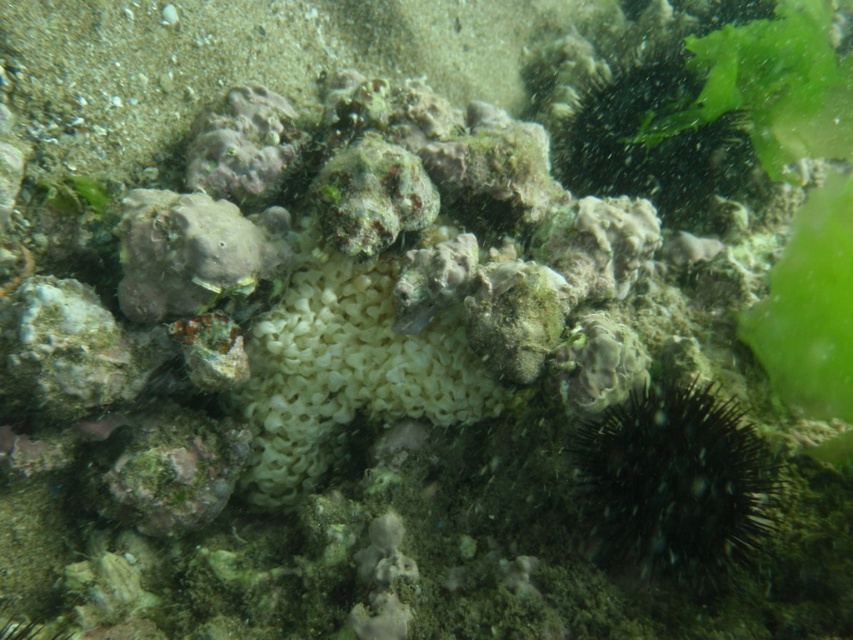
Looking at this image, you are a marine biologist observing the underwater scene. You need to locate the black spiny sea urchin at lower right and the white sponge at center. Which object is positioned lower in the image?

The black spiny sea urchin at lower right is located below the white sponge at center, so it is positioned lower in the image.

You are a marine biologist using a remotely operated vehicle to inspect underwater life. Your ROV is positioned at the camera location. You need to collect a sample from the black spiny sea urchin at lower right. What is the approximate distance you need to travel to reach it?

The black spiny sea urchin at lower right is approximately 3.47 feet away from the camera, so the ROV needs to travel about 3.47 feet to reach it.

You are a marine biologist observing this underwater scene. You need to collect samples from both the black spiny sea urchin at lower right and the white sponge at center. Based on their positions, which one do you think you can reach first without moving your current position?

The black spiny sea urchin at lower right is in front of the white sponge at center, so you can reach the black spiny sea urchin at lower right first without moving.